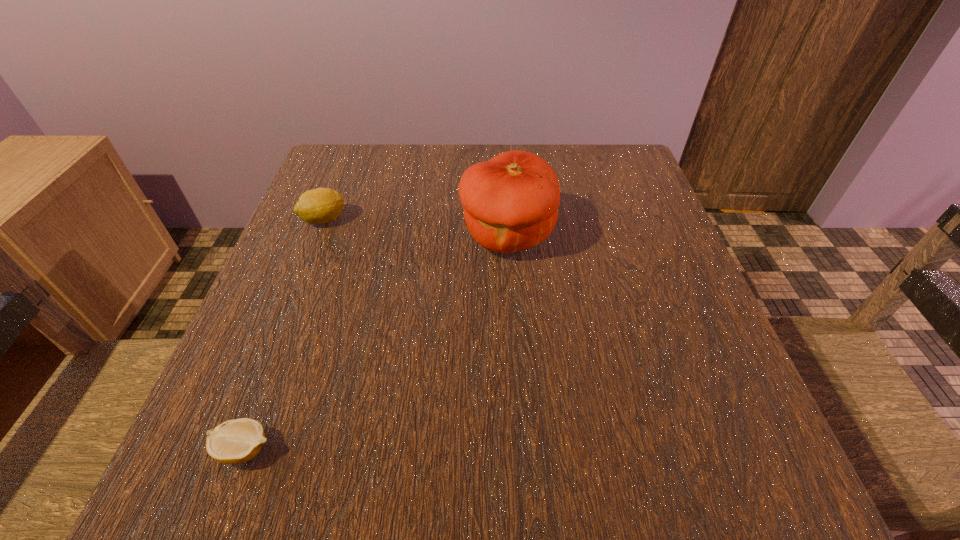
Locate an element on the screen. free region that satisfies the following two spatial constraints: 1. at the stem end of the taller lemon; 2. on the back side of the tallest object is located at coordinates (318, 235).

This screenshot has height=540, width=960. In order to click on vacant space that satisfies the following two spatial constraints: 1. on the back side of the rightmost object; 2. at the stem end of the taller lemon in this screenshot , I will do `click(506, 220)`.

Where is `free space that satisfies the following two spatial constraints: 1. at the stem end of the second tallest object; 2. on the right side of the tallest object`? free space that satisfies the following two spatial constraints: 1. at the stem end of the second tallest object; 2. on the right side of the tallest object is located at coordinates (318, 235).

Where is `blank area in the image that satisfies the following two spatial constraints: 1. on the back side of the tallest object; 2. at the stem end of the taller lemon`? This screenshot has height=540, width=960. blank area in the image that satisfies the following two spatial constraints: 1. on the back side of the tallest object; 2. at the stem end of the taller lemon is located at coordinates (506, 220).